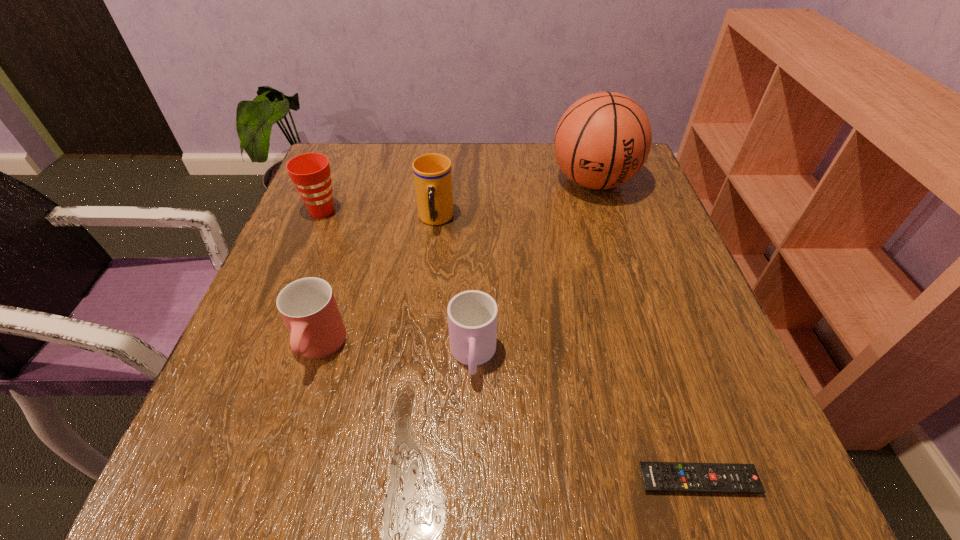
You are a GUI agent. You are given a task and a screenshot of the screen. Output one action in this format:
    pyautogui.click(x=<x>, y=<y>)
    Task: Click on the basketball
    This screenshot has width=960, height=540.
    Given the screenshot: What is the action you would take?
    pyautogui.click(x=603, y=139)

The width and height of the screenshot is (960, 540). In order to click on the second cup from right to left in this screenshot , I will do `click(432, 172)`.

Locate an element on the screen. The height and width of the screenshot is (540, 960). the leftmost object is located at coordinates (310, 172).

The height and width of the screenshot is (540, 960). Identify the location of the third cup from right to left. (308, 307).

At what (x,y) coordinates should I click in order to perform the action: click on the fourth object from left to right. Please return your answer as a coordinate pair (x, y). Looking at the image, I should click on (472, 315).

I want to click on the nearest object, so click(x=657, y=476).

Image resolution: width=960 pixels, height=540 pixels. What are the coordinates of `remote control` in the screenshot? It's located at (657, 476).

Where is `free space located 0.300m on the surface of the basketball near the brand logo`? free space located 0.300m on the surface of the basketball near the brand logo is located at coordinates (633, 308).

I want to click on vacant space located on the side of the fourth object from right to left with the handle, so click(x=428, y=285).

This screenshot has height=540, width=960. I want to click on free space located 0.360m on the front of the leftmost cup, so click(x=262, y=361).